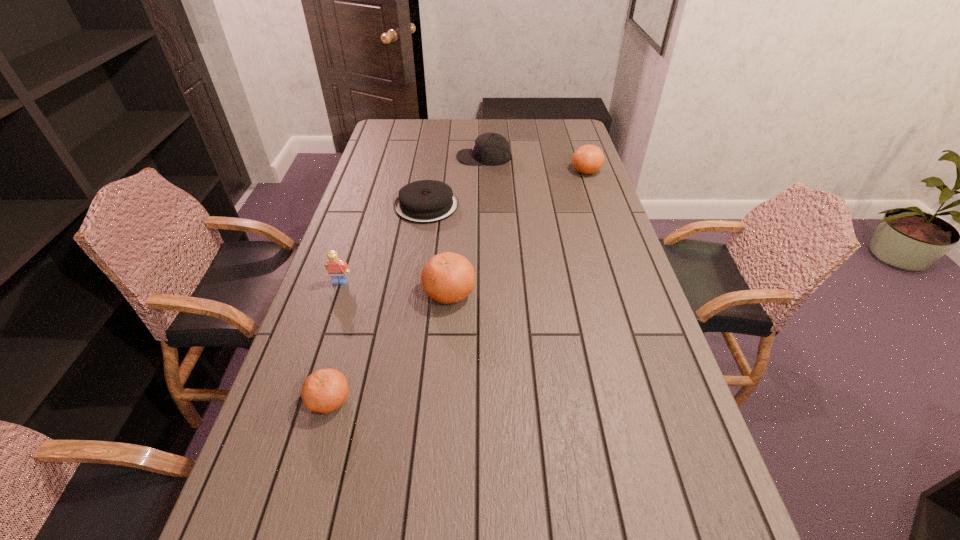
Locate which clementine ranks in proximity to the Lego. Please provide its 2D coordinates. Your answer should be formatted as a tuple, i.e. [(x, y)], where the tuple contains the x and y coordinates of a point satisfying the conditions above.

[(447, 277)]

I want to click on free region that satisfies the following two spatial constraints: 1. on the front-facing side of the cap; 2. on the front side of the second nearest clementine, so click(487, 293).

Locate an element on the screen. vacant region that satisfies the following two spatial constraints: 1. on the front-facing side of the second farthest clementine; 2. on the left side of the Lego is located at coordinates [336, 293].

Locate an element on the screen. The height and width of the screenshot is (540, 960). free spot that satisfies the following two spatial constraints: 1. on the front-facing side of the cap; 2. on the front side of the fifth tallest object is located at coordinates (488, 400).